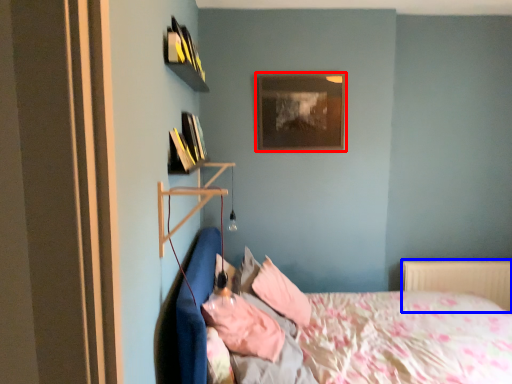
Question: Which of the following is the farthest to the observer, picture frame (highlighted by a red box) or radiator (highlighted by a blue box)?

Choices:
 (A) picture frame
 (B) radiator

Answer: (B)